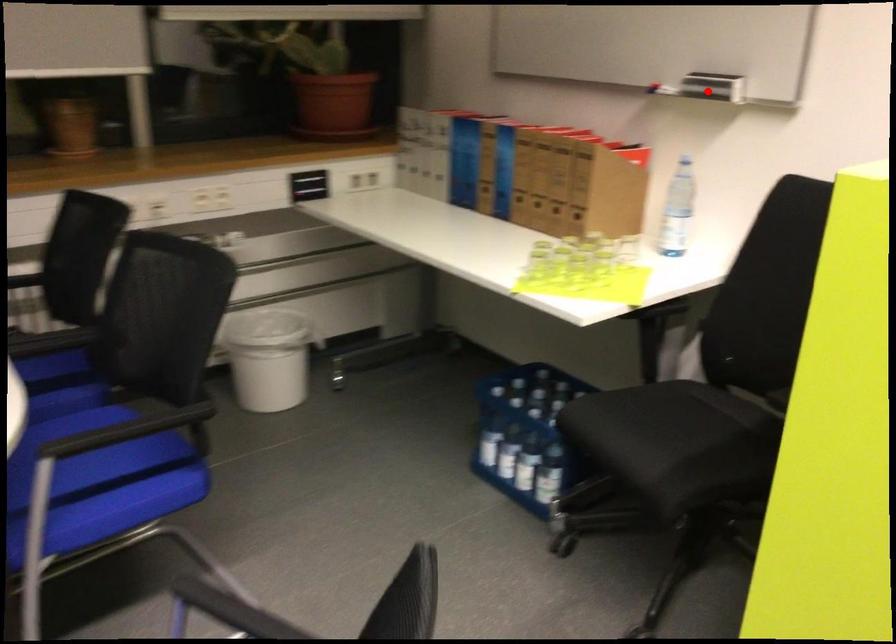
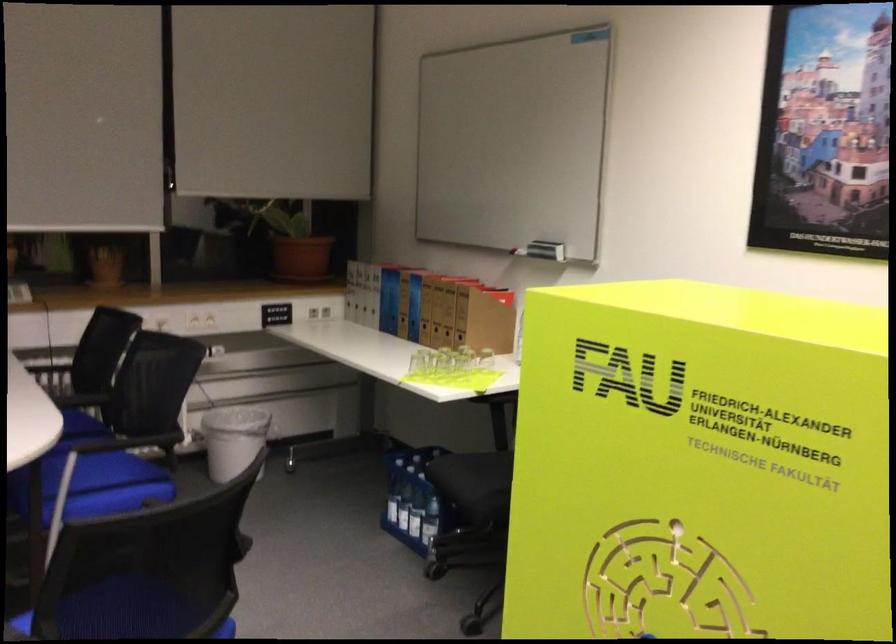
Question: I am providing you with two images of the same scene from different viewpoints. A red point is marked on the first image. Is the red point's position out of view in image 2?

Choices:
 (A) Yes
 (B) No

Answer: (B)